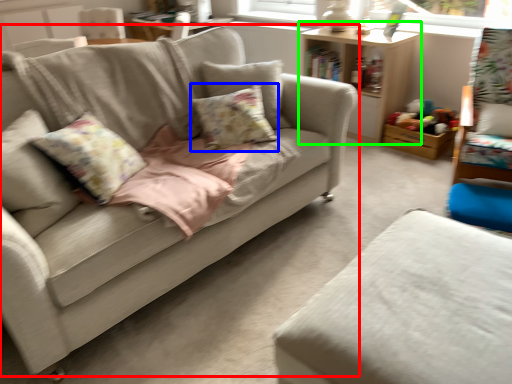
Question: Estimate the real-world distances between objects in this image. Which object is closer to studio couch (highlighted by a red box), pillow (highlighted by a blue box) or table (highlighted by a green box)?

Choices:
 (A) pillow
 (B) table

Answer: (A)